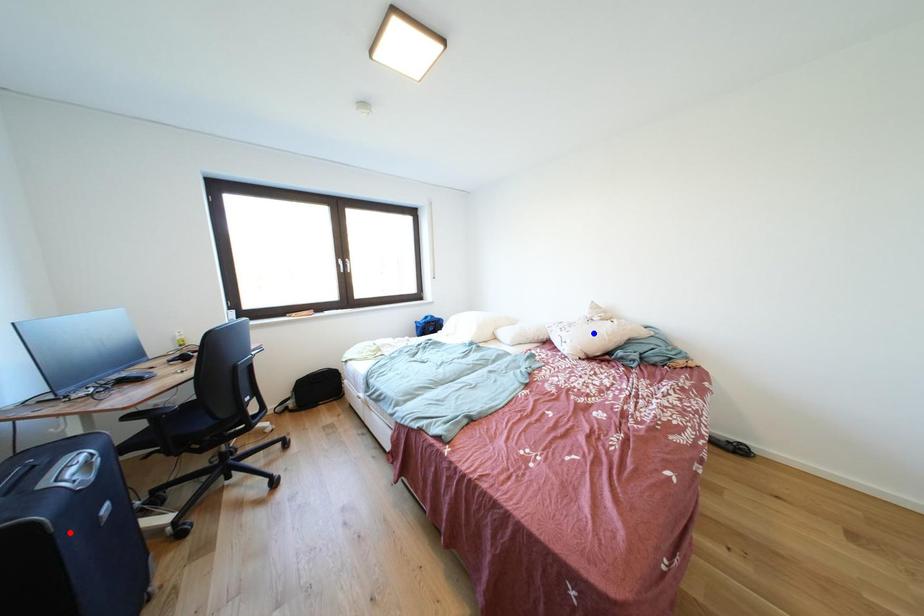
Question: Two points are marked on the image. Which point is closer to the camera?

Choices:
 (A) Blue point is closer.
 (B) Red point is closer.

Answer: (B)